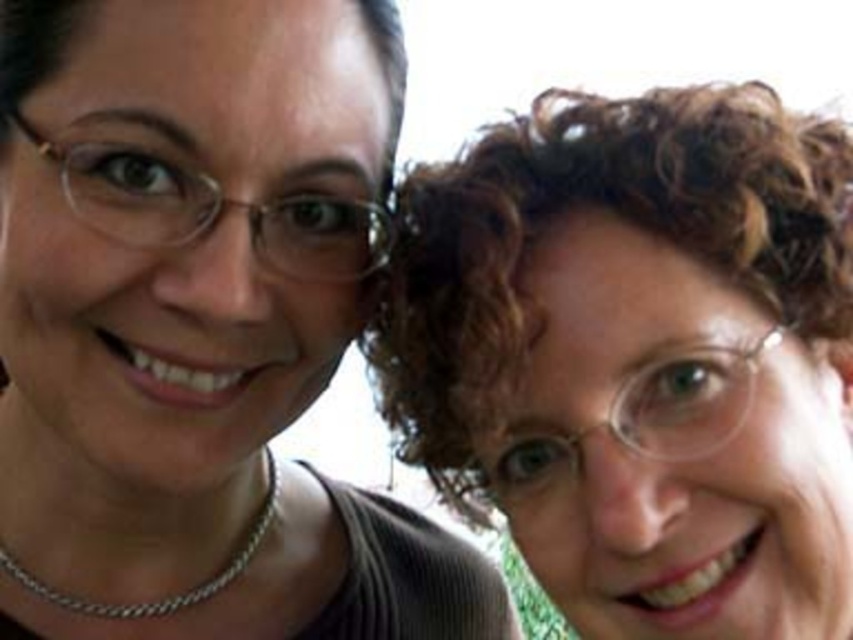
You are a photographer trying to adjust the composition of the photo. You want to ensure that the matte black hair at upper right and curly hair at upper right are both visible. Based on their positions, which hair should you focus on moving upwards to avoid overlap?

The matte black hair at upper right is located below curly hair at upper right, so you should focus on moving the matte black hair at upper right upwards to avoid overlap.

You are a photographer trying to focus on the matte black hair at upper right and the silver chain necklace at left. Which object should you adjust your focus to first if you want to capture both clearly in the photo?

The matte black hair at upper right should be focused on first since it is larger in size than the silver chain necklace at left, making it more prominent in the frame.